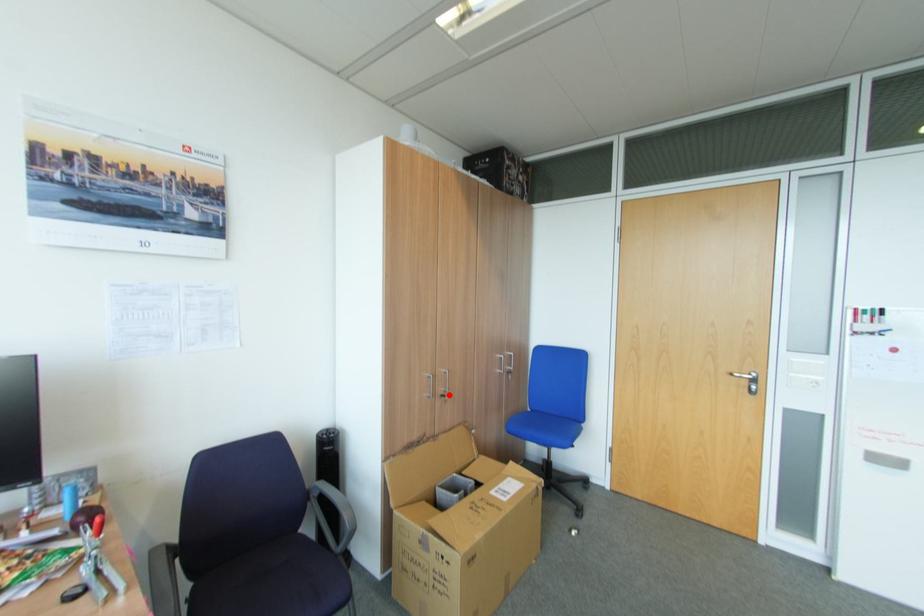
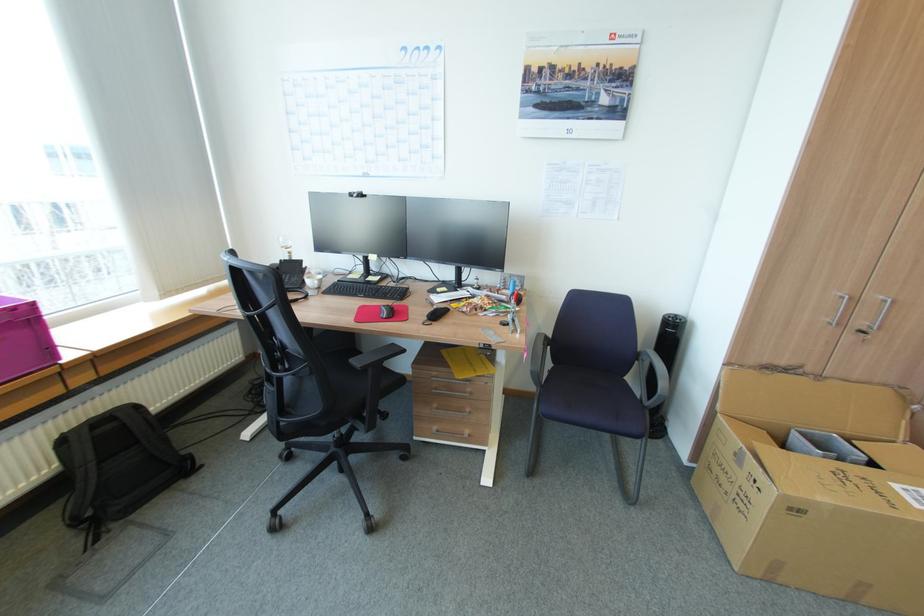
Locate, in the second image, the point that corresponds to the highlighted location in the first image.

(868, 331)